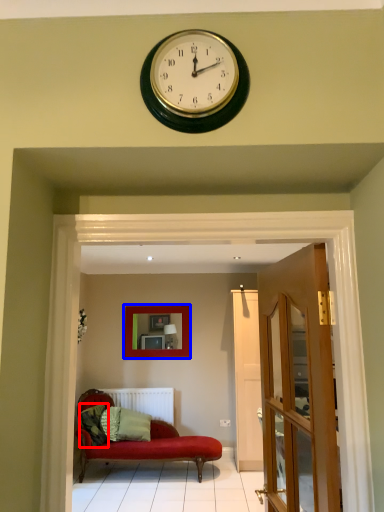
Question: Which of the following is the closest to the observer, pillow (highlighted by a red box) or picture frame (highlighted by a blue box)?

Choices:
 (A) pillow
 (B) picture frame

Answer: (A)